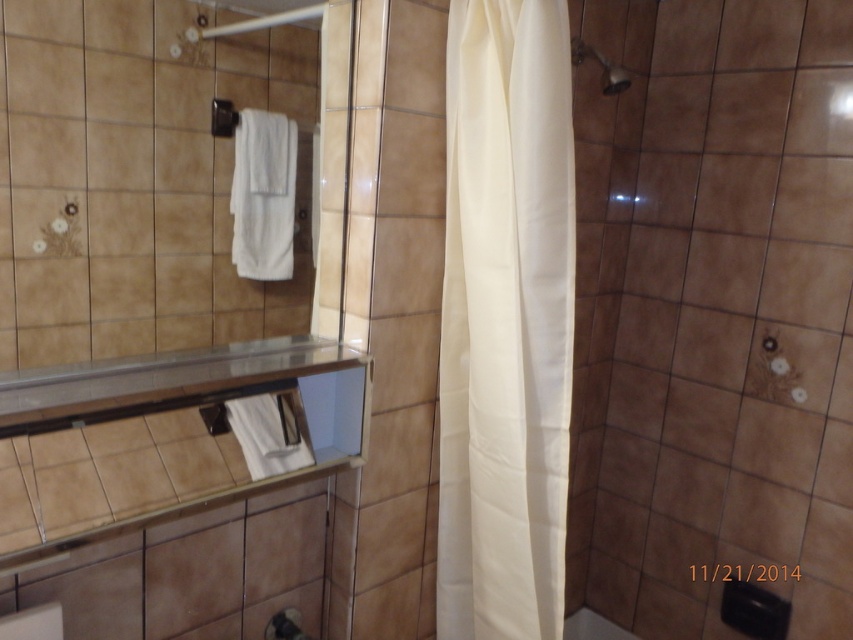
You are standing in the bathroom and want to reach the matte silver shower head at upper right to clean it. Is the white fabric shower curtain at center in your way?

The white fabric shower curtain at center is closer to the viewer than the matte silver shower head at upper right, so it would block access to the shower head. You would need to move the shower curtain aside to reach the shower head.

You are standing in the bathroom and want to reach the glass shelf to the left. The shower curtain is in your way. Based on the coordinates given, can you move to the left of the white fabric shower curtain at center to access the glass shelf?

The white fabric shower curtain at center is positioned at coordinates point (505, 321). Since the glass shelf is to the left, moving to the left of the shower curtain would allow access to the glass shelf.

You are designing a bathroom layout and need to ensure that the white fabric shower curtain at center and the matte silver shower head at upper right are visible from the entrance. Since the shower curtain is larger, will it block the view of the shower head?

The white fabric shower curtain at center is bigger than the matte silver shower head at upper right, so it might block the view of the shower head if positioned in front of it. Adjust placement to ensure visibility.